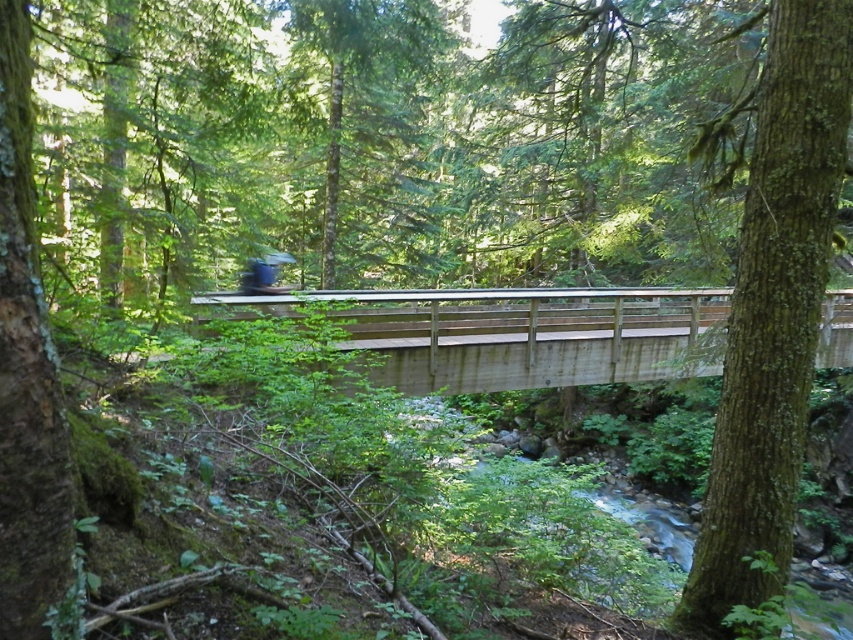
You are a hiker who wants to take a photo of the green rough bark tree at center and the green rough bark tree at left. Which tree should you stand closer to in order to capture both trees in the same frame?

You should stand closer to the green rough bark tree at left because it is smaller than the green rough bark tree at center, allowing both to fit within the frame when positioned nearer to the smaller tree.

You are standing at the center of the wooden bridge and want to find the green rough bark tree at center. According to the coordinates provided, in which direction should you look to locate it?

The green rough bark tree at center is located at coordinates point (775, 308), which is slightly to the right and lower than the center point of the image. Therefore, you should look slightly to your right and downward from the center to locate it.

You are a hiker carrying a backpack weighing 15 kilograms. You need to cross the wooden bridge at center. Given that the bridge can safely hold a maximum weight of 10 kilograms per square meter, and your total weight including the backpack is 80 kilograms, is the bridge safe to cross?

The wooden bridge at center is 9.56 meters away from you. To determine safety, calculate the area of the bridge deck. However, without knowing the bridge width or its total area, it is impossible to confirm if the 10 kg per square meter limit is exceeded by your 80 kg weight. Thus, crossing may be risky without more information.